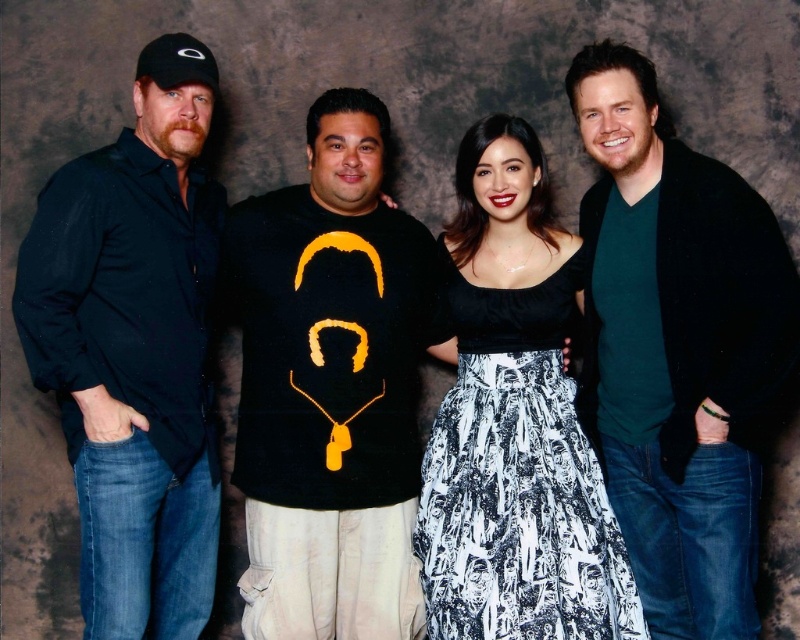
Question: Which of the following is the closest to the observer?

Choices:
 (A) (462, 406)
 (B) (318, 250)
 (C) (674, 529)

Answer: (B)

Question: Is green matte shirt at center further to the viewer compared to black matte shirt at left?

Choices:
 (A) no
 (B) yes

Answer: (A)

Question: Can you confirm if black matte t-shirt at center is positioned to the left of black matte shirt at left?

Choices:
 (A) no
 (B) yes

Answer: (A)

Question: Which of the following is the closest to the observer?

Choices:
 (A) black matte shirt at left
 (B) black matte t-shirt at center
 (C) green matte shirt at center

Answer: (C)

Question: Does black matte t-shirt at center have a lesser width compared to black satin dress at center?

Choices:
 (A) no
 (B) yes

Answer: (A)

Question: Estimate the real-world distances between objects in this image. Which object is closer to the black satin dress at center?

Choices:
 (A) black matte shirt at left
 (B) black matte t-shirt at center

Answer: (B)